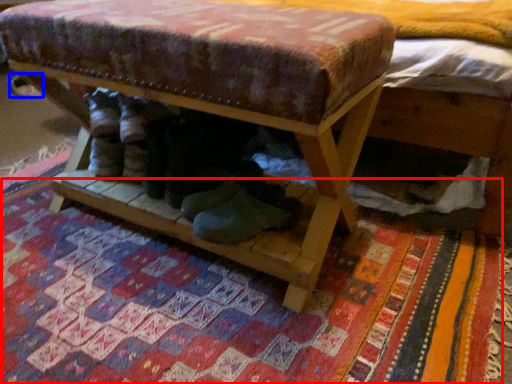
Question: Which object appears farthest to the camera in this image, mat (highlighted by a red box) or shoe (highlighted by a blue box)?

Choices:
 (A) mat
 (B) shoe

Answer: (B)